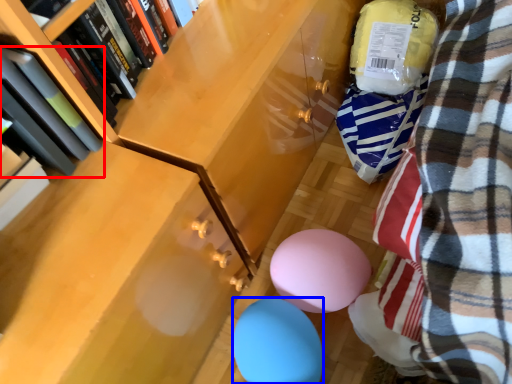
Question: Which object appears closest to the camera in this image, book (highlighted by a red box) or balloon (highlighted by a blue box)?

Choices:
 (A) book
 (B) balloon

Answer: (A)